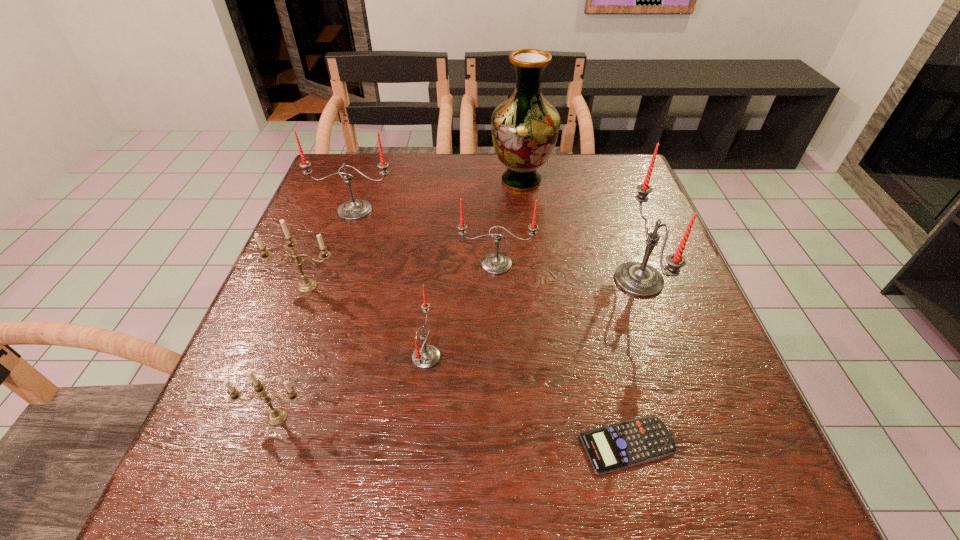
In order to click on the sixth farthest object in this screenshot , I will do `click(426, 356)`.

Identify the location of the nearest candle. (277, 416).

Identify the location of the nearer metallic candle. The height and width of the screenshot is (540, 960). (277, 416).

Find the location of a particular element. the shortest object is located at coordinates (617, 446).

This screenshot has width=960, height=540. What are the coordinates of `calculator` in the screenshot? It's located at (617, 446).

Where is `vacant space situated on the front of the tallest object`? vacant space situated on the front of the tallest object is located at coordinates (529, 242).

Locate an element on the screen. The width and height of the screenshot is (960, 540). vacant space located on the front-facing side of the rightmost candle is located at coordinates (515, 280).

Locate an element on the screen. This screenshot has width=960, height=540. free space located on the front-facing side of the rightmost candle is located at coordinates (560, 280).

This screenshot has height=540, width=960. In order to click on vacant point located on the front-facing side of the rightmost candle in this screenshot , I will do `click(460, 280)`.

This screenshot has width=960, height=540. Find the location of `free space located on the front-facing side of the second biggest red candle`. free space located on the front-facing side of the second biggest red candle is located at coordinates (334, 273).